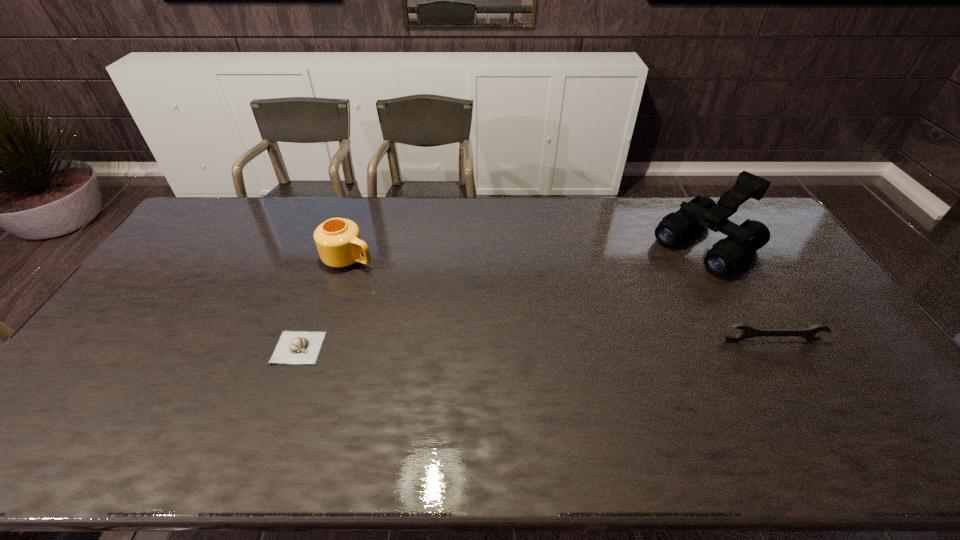
Where is `garlic`? garlic is located at coordinates (293, 347).

I want to click on the second shortest object, so click(x=747, y=332).

Where is `the tallest object`? This screenshot has width=960, height=540. the tallest object is located at coordinates (743, 240).

At what (x,y) coordinates should I click in order to perform the action: click on mug. Please return your answer as a coordinate pair (x, y). This screenshot has width=960, height=540. Looking at the image, I should click on (338, 241).

Locate an element on the screen. The height and width of the screenshot is (540, 960). vacant point located 0.050m on the front of the shortest object is located at coordinates (286, 381).

The height and width of the screenshot is (540, 960). I want to click on vacant area situated 0.050m on the open ends of the wrench, so click(780, 357).

Image resolution: width=960 pixels, height=540 pixels. In order to click on vacant space positioned 0.270m on the front lenses of the binoculars in this screenshot , I will do `click(623, 306)`.

The height and width of the screenshot is (540, 960). In order to click on vacant region located 0.170m on the front lenses of the binoculars in this screenshot , I will do `click(643, 291)`.

Where is `free space located on the front lenses of the binoculars`? This screenshot has height=540, width=960. free space located on the front lenses of the binoculars is located at coordinates (666, 274).

Image resolution: width=960 pixels, height=540 pixels. In order to click on free space located 0.210m on the handle side of the mug in this screenshot , I will do point(423,287).